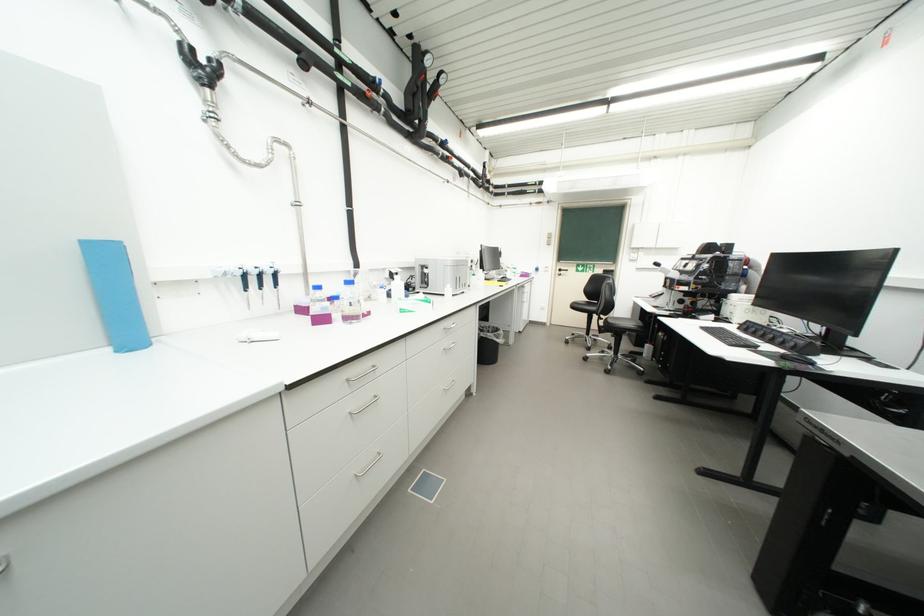
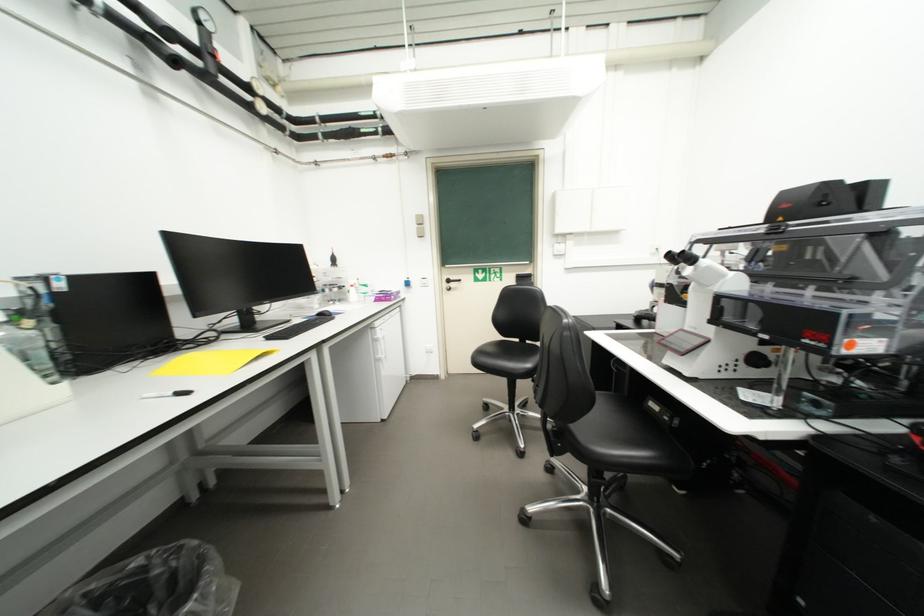
Locate, in the second image, the point that corresponds to point (631, 257) in the first image.

(553, 249)